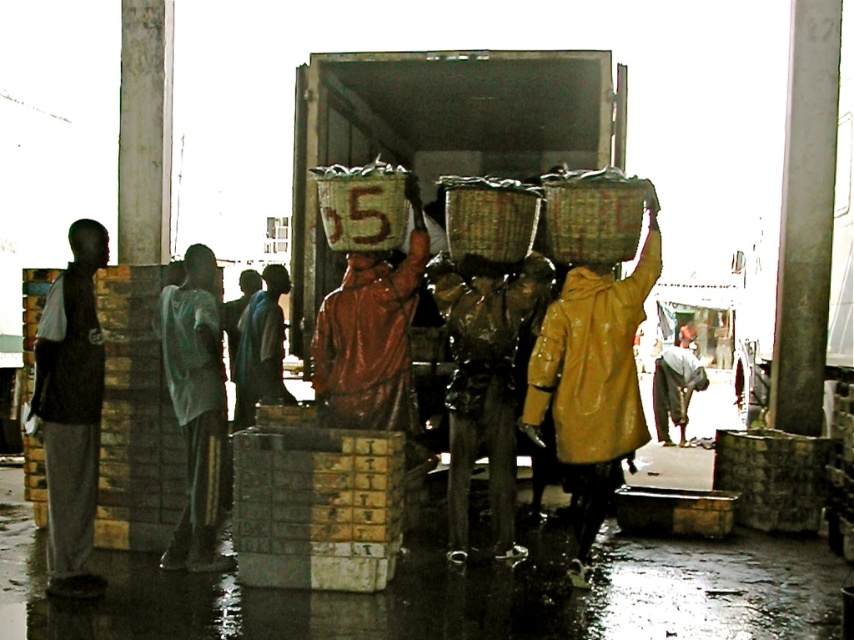
Question: Is shiny plastic head at center bigger than dark skin head at center?

Choices:
 (A) yes
 (B) no

Answer: (B)

Question: Which of the following is the farthest from the observer?

Choices:
 (A) (80, 381)
 (B) (247, 285)
 (C) (278, 285)

Answer: (B)

Question: Among these objects, which one is nearest to the camera?

Choices:
 (A) matte brown head at center
 (B) yellow matte head at center
 (C) shiny orange helmet at center
 (D) brown glossy statue at center

Answer: (B)

Question: Which object is positioned closest to the shiny orange helmet at center?

Choices:
 (A) light green fabric shirt at left
 (B) brown glossy statue at center
 (C) matte brown head at center
 (D) yellow matte head at center

Answer: (B)

Question: Does shiny orange helmet at center have a lesser width compared to yellow matte head at center?

Choices:
 (A) yes
 (B) no

Answer: (A)

Question: Is the position of brown glossy statue at center more distant than that of shiny orange helmet at center?

Choices:
 (A) no
 (B) yes

Answer: (A)